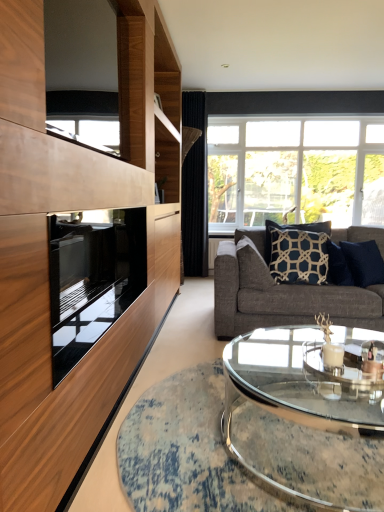
Question: Can you confirm if dark blue textured pillow at center, the 1th pillow from the left, is thinner than black velvet curtain at center?

Choices:
 (A) yes
 (B) no

Answer: (B)

Question: From the image's perspective, is dark blue textured pillow at center, the 1th pillow from the left, located beneath black velvet curtain at center?

Choices:
 (A) yes
 (B) no

Answer: (A)

Question: Is dark blue textured pillow at center, the 1th pillow from the left, positioned far away from black velvet curtain at center?

Choices:
 (A) no
 (B) yes

Answer: (B)

Question: Is dark blue textured pillow at center, the 1th pillow from the left, positioned behind black velvet curtain at center?

Choices:
 (A) yes
 (B) no

Answer: (B)

Question: Considering the relative sizes of dark blue textured pillow at center, the 1th pillow from the left, and black velvet curtain at center in the image provided, is dark blue textured pillow at center, the 1th pillow from the left, taller than black velvet curtain at center?

Choices:
 (A) no
 (B) yes

Answer: (A)

Question: Considering the relative positions of dark blue textured pillow at center, which is the 3th pillow in right-to-left order, and clear glass coffee table at center in the image provided, is dark blue textured pillow at center, which is the 3th pillow in right-to-left order, to the left or to the right of clear glass coffee table at center?

Choices:
 (A) left
 (B) right

Answer: (A)

Question: From the image's perspective, is dark blue textured pillow at center, which is the 3th pillow in right-to-left order, located above or below clear glass coffee table at center?

Choices:
 (A) above
 (B) below

Answer: (A)

Question: Considering their positions, is dark blue textured pillow at center, which is the 3th pillow in right-to-left order, located in front of or behind clear glass coffee table at center?

Choices:
 (A) behind
 (B) front

Answer: (A)

Question: From a real-world perspective, relative to clear glass coffee table at center, is dark blue textured pillow at center, which is the 3th pillow in right-to-left order, vertically above or below?

Choices:
 (A) above
 (B) below

Answer: (A)

Question: From a real-world perspective, is black velvet curtain at center positioned above or below navy blue fabric pillow at center, which ranks as the 2th pillow in right-to-left order?

Choices:
 (A) below
 (B) above

Answer: (B)

Question: From the image's perspective, is black velvet curtain at center positioned above or below navy blue fabric pillow at center, which ranks as the 2th pillow in right-to-left order?

Choices:
 (A) above
 (B) below

Answer: (A)

Question: From their relative heights in the image, would you say black velvet curtain at center is taller or shorter than navy blue fabric pillow at center, marked as the 2th pillow in a left-to-right arrangement?

Choices:
 (A) tall
 (B) short

Answer: (A)

Question: In the image, is black velvet curtain at center positioned in front of or behind navy blue fabric pillow at center, which ranks as the 2th pillow in right-to-left order?

Choices:
 (A) behind
 (B) front

Answer: (A)

Question: Visually, is dark blue textured pillow at center, the 1th pillow from the left, positioned to the left or to the right of black velvet curtain at center?

Choices:
 (A) left
 (B) right

Answer: (B)

Question: Considering the positions of dark blue textured pillow at center, the 1th pillow from the left, and black velvet curtain at center in the image, is dark blue textured pillow at center, the 1th pillow from the left, bigger or smaller than black velvet curtain at center?

Choices:
 (A) big
 (B) small

Answer: (B)